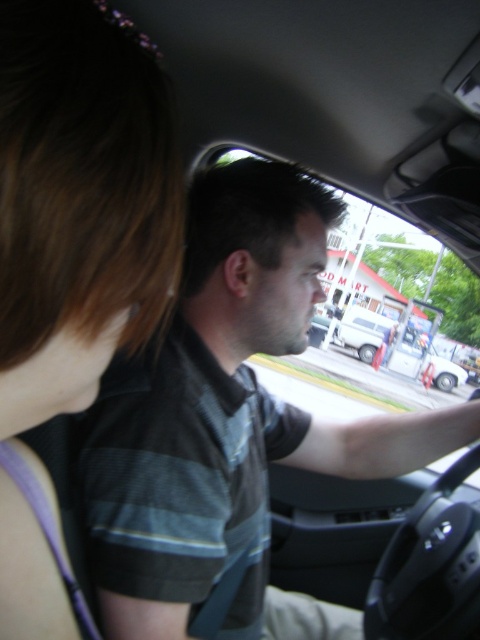
Question: Which of the following is the closest to the observer?

Choices:
 (A) (374, 330)
 (B) (86, 504)

Answer: (B)

Question: Is the position of brown hair at upper left less distant than that of white matte van at center?

Choices:
 (A) yes
 (B) no

Answer: (A)

Question: Which object appears farthest from the camera in this image?

Choices:
 (A) dark green striped shirt at center
 (B) brown hair at upper left
 (C) white matte van at center

Answer: (C)

Question: Can you confirm if dark green striped shirt at center is bigger than white matte van at center?

Choices:
 (A) no
 (B) yes

Answer: (A)

Question: Which of the following is the farthest from the observer?

Choices:
 (A) (407, 356)
 (B) (29, 163)
 (C) (160, 576)

Answer: (A)

Question: Does dark green striped shirt at center appear on the right side of white matte van at center?

Choices:
 (A) yes
 (B) no

Answer: (B)